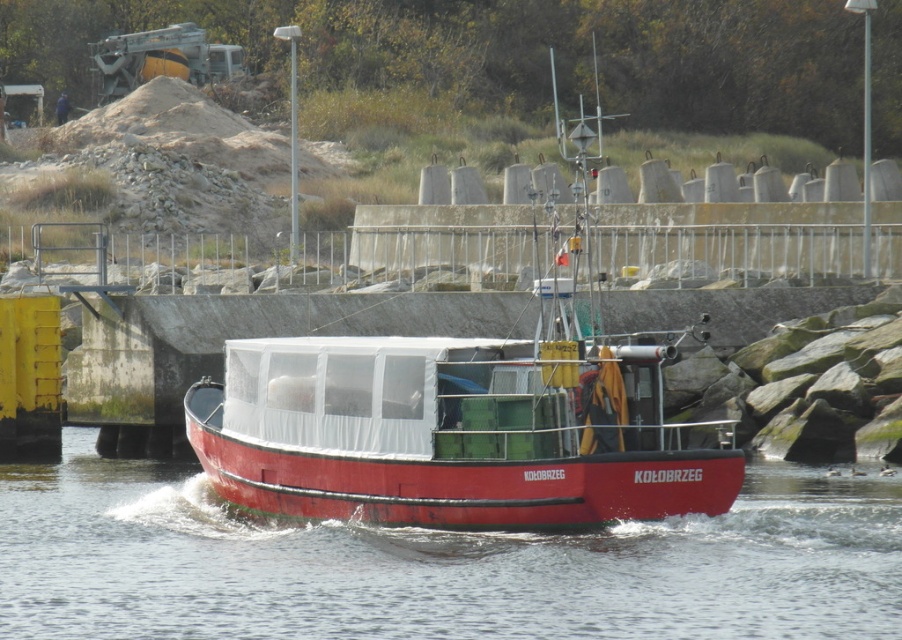
Is transparent plastic water at center shorter than red matte boat at center?

Indeed, transparent plastic water at center has a lesser height compared to red matte boat at center.

Who is more distant from viewer, (861, 621) or (468, 346)?

Positioned behind is point (468, 346).

Describe the element at coordinates (437, 564) in the screenshot. The height and width of the screenshot is (640, 902). I see `transparent plastic water at center` at that location.

Where is `transparent plastic water at center`? The width and height of the screenshot is (902, 640). transparent plastic water at center is located at coordinates (437, 564).